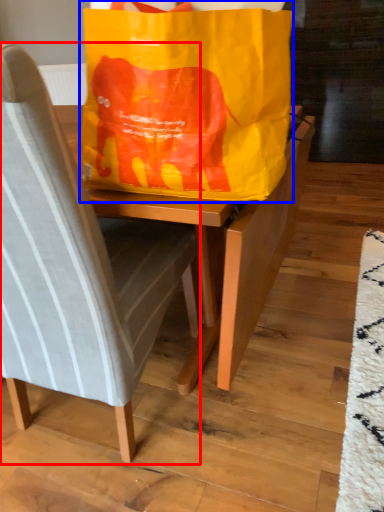
Question: Which of the following is the farthest to the observer, chair (highlighted by a red box) or grocery bag (highlighted by a blue box)?

Choices:
 (A) chair
 (B) grocery bag

Answer: (B)